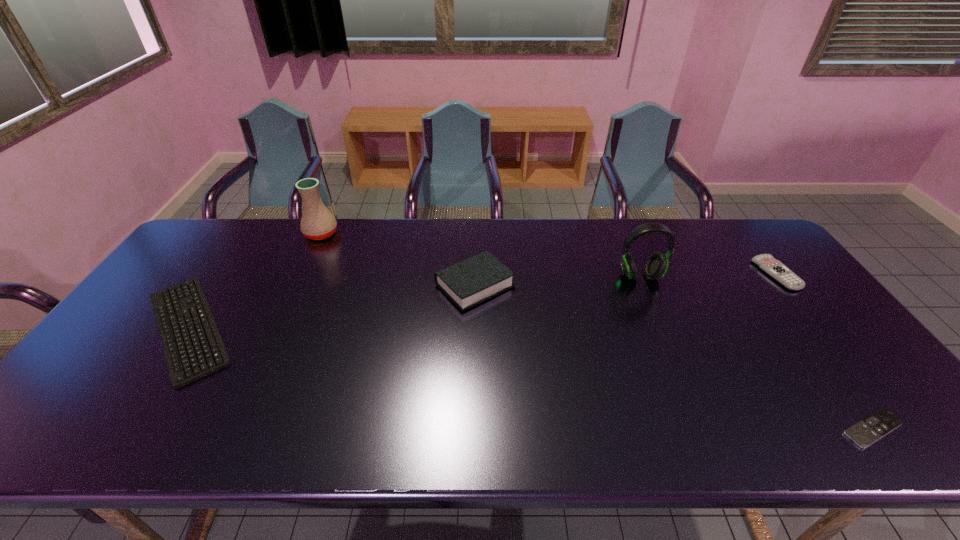
Locate an element on the screen. Image resolution: width=960 pixels, height=540 pixels. pottery is located at coordinates (317, 223).

The width and height of the screenshot is (960, 540). Find the location of `the farthest object`. the farthest object is located at coordinates (317, 223).

At what (x,y) coordinates should I click in order to perform the action: click on the third object from right to left. Please return your answer as a coordinate pair (x, y). Looking at the image, I should click on (656, 266).

Where is `Bible`? This screenshot has height=540, width=960. Bible is located at coordinates (467, 283).

Locate an element on the screen. The width and height of the screenshot is (960, 540). the fourth object from right to left is located at coordinates (467, 283).

You are a GUI agent. You are given a task and a screenshot of the screen. Output one action in this format:
    pyautogui.click(x=<x>, y=<y>)
    Task: Click on the taller remote control
    Image resolution: width=960 pixels, height=540 pixels.
    Given the screenshot: What is the action you would take?
    pyautogui.click(x=766, y=262)

You are a GUI agent. You are given a task and a screenshot of the screen. Output one action in this format:
    pyautogui.click(x=<x>, y=<y>)
    Task: Click on the computer keyboard
    
    Given the screenshot: What is the action you would take?
    pyautogui.click(x=193, y=347)

Image resolution: width=960 pixels, height=540 pixels. I want to click on the nearest object, so click(x=865, y=432).

Find the location of `the nearer remote control`. the nearer remote control is located at coordinates (865, 432).

Where is `vacant space located 0.370m on the front of the pottery`? The height and width of the screenshot is (540, 960). vacant space located 0.370m on the front of the pottery is located at coordinates (278, 325).